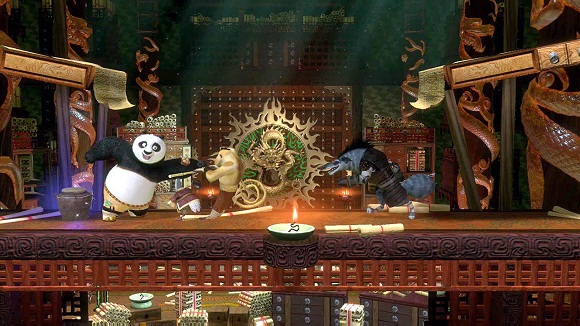
Locate an element on the screen. countertop is located at coordinates (314, 220).